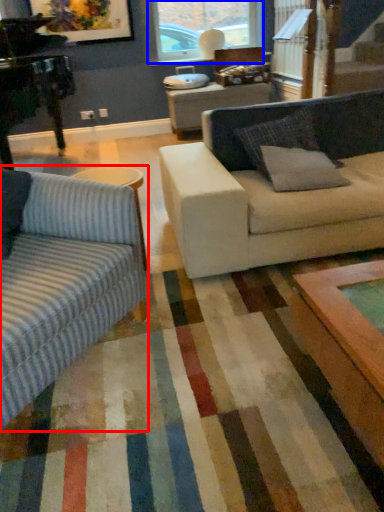
Question: Among these objects, which one is farthest to the camera, studio couch (highlighted by a red box) or window (highlighted by a blue box)?

Choices:
 (A) studio couch
 (B) window

Answer: (B)